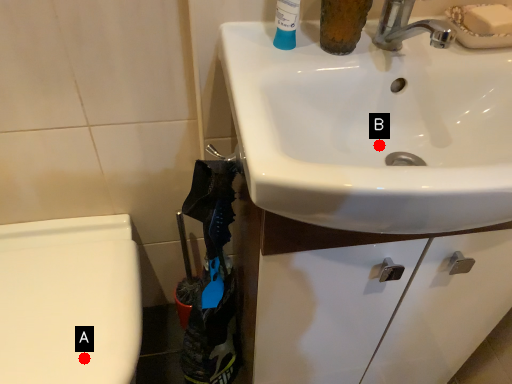
Question: Two points are circled on the image, labeled by A and B beside each circle. Which point is closer to the camera taking this photo?

Choices:
 (A) A is closer
 (B) B is closer

Answer: (B)